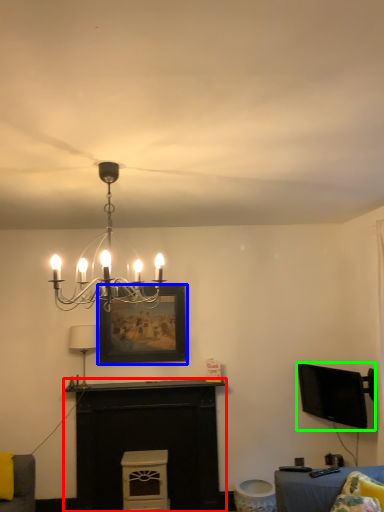
Question: Which is nearer to the fireplace (highlighted by a red box)? picture frame (highlighted by a blue box) or television (highlighted by a green box).

Choices:
 (A) picture frame
 (B) television

Answer: (A)